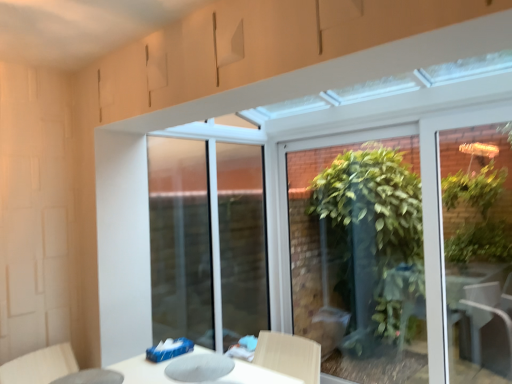
Question: Based on their sizes in the image, would you say green leafy plant at center is bigger or smaller than transparent glass table at lower left?

Choices:
 (A) big
 (B) small

Answer: (A)

Question: Is point (415, 352) closer or farther from the camera than point (117, 377)?

Choices:
 (A) farther
 (B) closer

Answer: (A)

Question: Considering the real-world distances, which object is farthest from the light beige fabric swivel chair at lower left?

Choices:
 (A) transparent glass table at lower left
 (B) green leafy plant at center

Answer: (B)

Question: Which object is positioned farthest from the light beige fabric swivel chair at lower left?

Choices:
 (A) transparent glass table at lower left
 (B) green leafy plant at center

Answer: (B)